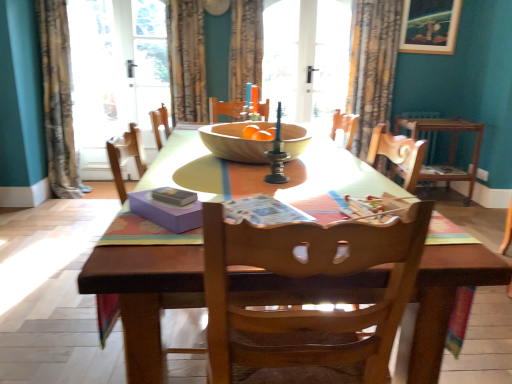
Question: Is patterned fabric curtain at left, arranged as the fourth curtain when viewed from the right, smaller than matte purple magazine at center, acting as the 1th magazine starting from the left?

Choices:
 (A) yes
 (B) no

Answer: (B)

Question: Is patterned fabric curtain at left, arranged as the fourth curtain when viewed from the right, taller than matte purple magazine at center, acting as the 1th magazine starting from the left?

Choices:
 (A) yes
 (B) no

Answer: (A)

Question: Is patterned fabric curtain at left, arranged as the fourth curtain when viewed from the right, behind matte purple magazine at center, the second magazine from the right?

Choices:
 (A) yes
 (B) no

Answer: (A)

Question: From a real-world perspective, is patterned fabric curtain at left, arranged as the fourth curtain when viewed from the right, located beneath matte purple magazine at center, the second magazine from the right?

Choices:
 (A) yes
 (B) no

Answer: (A)

Question: Can you confirm if patterned fabric curtain at left, which appears as the 1th curtain when viewed from the left, is positioned to the right of matte purple magazine at center, acting as the 1th magazine starting from the left?

Choices:
 (A) no
 (B) yes

Answer: (A)

Question: Does patterned fabric curtain at left, which appears as the 1th curtain when viewed from the left, contain matte purple magazine at center, acting as the 1th magazine starting from the left?

Choices:
 (A) yes
 (B) no

Answer: (B)

Question: Is patterned fabric curtain at upper right, which is the 1th curtain from right to left, positioned behind velvet-like brown curtain at upper center, which appears as the 2th curtain when viewed from the left?

Choices:
 (A) no
 (B) yes

Answer: (A)

Question: Can you confirm if patterned fabric curtain at upper right, which is the 1th curtain from right to left, is thinner than velvet-like brown curtain at upper center, which appears as the 2th curtain when viewed from the left?

Choices:
 (A) yes
 (B) no

Answer: (B)

Question: From a real-world perspective, does patterned fabric curtain at upper right, which is the 1th curtain from right to left, sit lower than velvet-like brown curtain at upper center, the 3th curtain in the right-to-left sequence?

Choices:
 (A) no
 (B) yes

Answer: (B)

Question: Is patterned fabric curtain at upper right, which is the 1th curtain from right to left, not inside velvet-like brown curtain at upper center, which appears as the 2th curtain when viewed from the left?

Choices:
 (A) yes
 (B) no

Answer: (A)

Question: Considering the relative sizes of patterned fabric curtain at upper right, which is the 1th curtain from right to left, and velvet-like brown curtain at upper center, the 3th curtain in the right-to-left sequence, in the image provided, is patterned fabric curtain at upper right, which is the 1th curtain from right to left, smaller than velvet-like brown curtain at upper center, the 3th curtain in the right-to-left sequence,?

Choices:
 (A) no
 (B) yes

Answer: (A)

Question: Is patterned fabric curtain at upper right, which is the 1th curtain from right to left, to the left of velvet-like brown curtain at upper center, the 3th curtain in the right-to-left sequence, from the viewer's perspective?

Choices:
 (A) no
 (B) yes

Answer: (A)

Question: Is velvet-like brown curtain at upper center, the 3th curtain in the right-to-left sequence, at the back of matte purple magazine at center, the second magazine from the right?

Choices:
 (A) yes
 (B) no

Answer: (B)